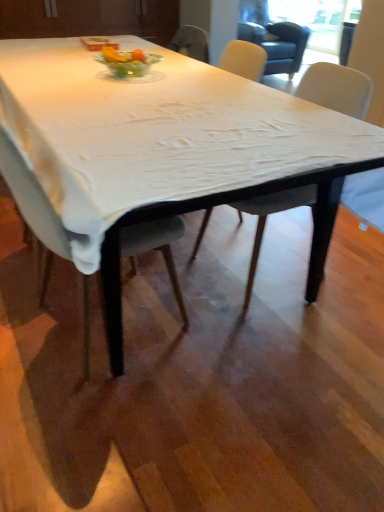
Question: Which is correct: clear glass bowl at center is inside white cloth-covered table at center, or outside of it?

Choices:
 (A) inside
 (B) outside

Answer: (B)

Question: Is point (107, 51) closer or farther from the camera than point (160, 78)?

Choices:
 (A) closer
 (B) farther

Answer: (B)

Question: Considering the real-world distances, which object is farthest from the matte gray chair at center, marked as the 1th chair in a left-to-right arrangement?

Choices:
 (A) white fabric chair at center, positioned as the 2th chair in left-to-right order
 (B) transparent glass window screen at upper right
 (C) white cloth-covered table at center
 (D) clear glass bowl at center

Answer: (B)

Question: Which object is positioned farthest from the transparent glass window screen at upper right?

Choices:
 (A) clear glass bowl at center
 (B) white fabric chair at center, which is the first chair from right to left
 (C) white cloth-covered table at center
 (D) matte gray chair at center, marked as the 1th chair in a left-to-right arrangement

Answer: (D)